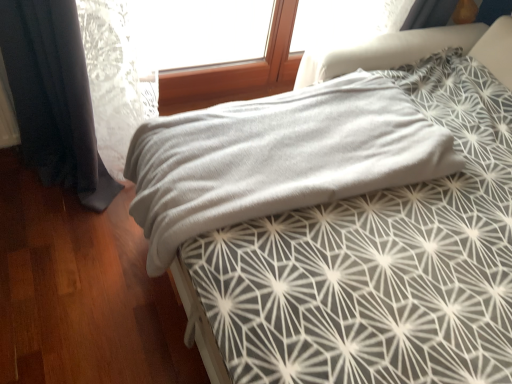
Question: Should I look upward or downward to see gray soft fabric at center?

Choices:
 (A) up
 (B) down

Answer: (A)

Question: Does gray soft fabric at center turn towards gray soft fabric at center?

Choices:
 (A) yes
 (B) no

Answer: (A)

Question: Can you confirm if gray soft fabric at center is smaller than gray soft fabric at center?

Choices:
 (A) no
 (B) yes

Answer: (B)

Question: Could gray soft fabric at center be considered to be inside gray soft fabric at center?

Choices:
 (A) no
 (B) yes

Answer: (A)

Question: Can you confirm if gray soft fabric at center is shorter than gray soft fabric at center?

Choices:
 (A) yes
 (B) no

Answer: (A)

Question: Is gray soft fabric at center behind gray soft fabric at center?

Choices:
 (A) no
 (B) yes

Answer: (B)

Question: From the image's perspective, is gray soft fabric at center located above gray soft fabric at center?

Choices:
 (A) yes
 (B) no

Answer: (B)

Question: Is gray soft fabric at center positioned beyond the bounds of gray soft fabric at center?

Choices:
 (A) yes
 (B) no

Answer: (A)

Question: Is gray soft fabric at center further to camera compared to gray soft fabric at center?

Choices:
 (A) yes
 (B) no

Answer: (B)

Question: Does gray soft fabric at center have a greater width compared to gray soft fabric at center?

Choices:
 (A) no
 (B) yes

Answer: (B)

Question: From a real-world perspective, is gray soft fabric at center located beneath gray soft fabric at center?

Choices:
 (A) no
 (B) yes

Answer: (A)

Question: Is gray soft fabric at center placed right next to gray soft fabric at center?

Choices:
 (A) yes
 (B) no

Answer: (A)

Question: Considering the relative positions of gray soft fabric at center and gray soft fabric at center in the image provided, is gray soft fabric at center in front of gray soft fabric at center?

Choices:
 (A) no
 (B) yes

Answer: (B)

Question: From the image's perspective, is gray soft fabric at center located above or below gray soft fabric at center?

Choices:
 (A) above
 (B) below

Answer: (B)